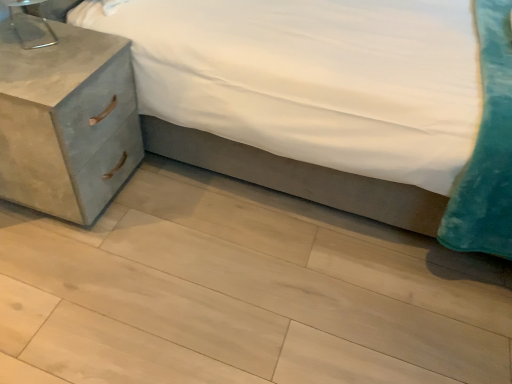
Question: Is metallic silver table lamp at upper left positioned in front of velvet teal pillow at lower right?

Choices:
 (A) no
 (B) yes

Answer: (A)

Question: Could you tell me if metallic silver table lamp at upper left is facing velvet teal pillow at lower right?

Choices:
 (A) no
 (B) yes

Answer: (B)

Question: Is the depth of metallic silver table lamp at upper left greater than that of velvet teal pillow at lower right?

Choices:
 (A) no
 (B) yes

Answer: (B)

Question: Is velvet teal pillow at lower right completely or partially inside metallic silver table lamp at upper left?

Choices:
 (A) yes
 (B) no

Answer: (B)

Question: From a real-world perspective, is metallic silver table lamp at upper left located higher than velvet teal pillow at lower right?

Choices:
 (A) no
 (B) yes

Answer: (B)

Question: Is metallic silver table lamp at upper left shorter than velvet teal pillow at lower right?

Choices:
 (A) no
 (B) yes

Answer: (B)

Question: Can you confirm if velvet teal pillow at lower right is positioned to the right of light wood floor at lower center?

Choices:
 (A) yes
 (B) no

Answer: (A)

Question: Is velvet teal pillow at lower right bigger than light wood floor at lower center?

Choices:
 (A) yes
 (B) no

Answer: (A)

Question: Can you confirm if velvet teal pillow at lower right is smaller than light wood floor at lower center?

Choices:
 (A) yes
 (B) no

Answer: (B)

Question: From a real-world perspective, is velvet teal pillow at lower right on light wood floor at lower center?

Choices:
 (A) no
 (B) yes

Answer: (B)

Question: From a real-world perspective, does velvet teal pillow at lower right sit lower than light wood floor at lower center?

Choices:
 (A) no
 (B) yes

Answer: (A)

Question: Can you confirm if velvet teal pillow at lower right is wider than light wood floor at lower center?

Choices:
 (A) no
 (B) yes

Answer: (B)

Question: Does metallic silver table lamp at upper left have a greater height compared to light wood floor at lower center?

Choices:
 (A) yes
 (B) no

Answer: (A)